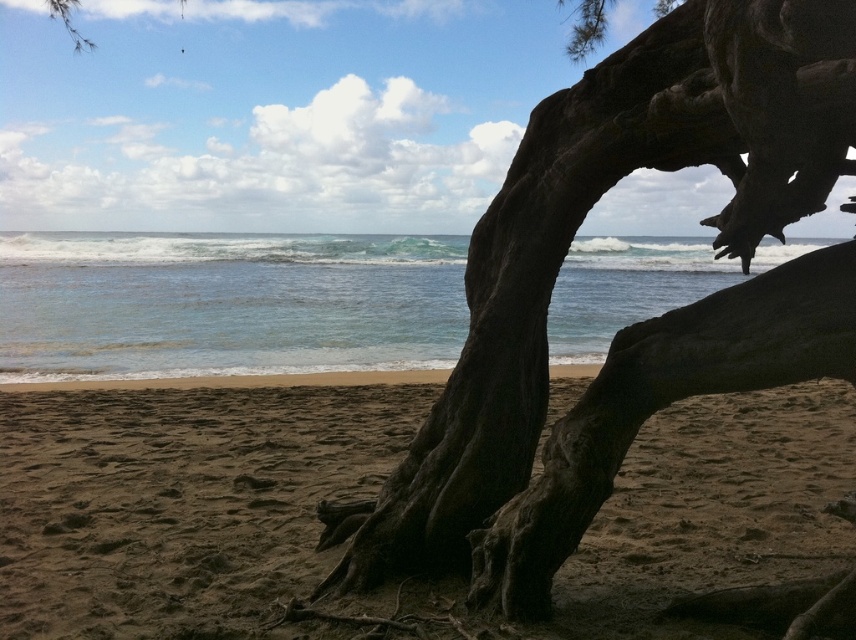
You are standing at the coordinates point 0.5, 0.5 in the image. You want to walk to the brown sandy beach at lower center. Which direction should you move?

The brown sandy beach at lower center is located at point (372, 496). Since you are at (428, 320), you should move southeast to reach it.

You are standing on the beach and want to place a small seashell on the dark brown wood at center so it won t be washed away by the clear blue water at center. Based on their heights, can you tell me which one is lower and thus safer for placing the seashell?

The dark brown wood at center has a lesser height compared to the clear blue water at center, so placing the seashell on the dark brown wood at center would be safer as it is lower and less likely to be reached by the water.